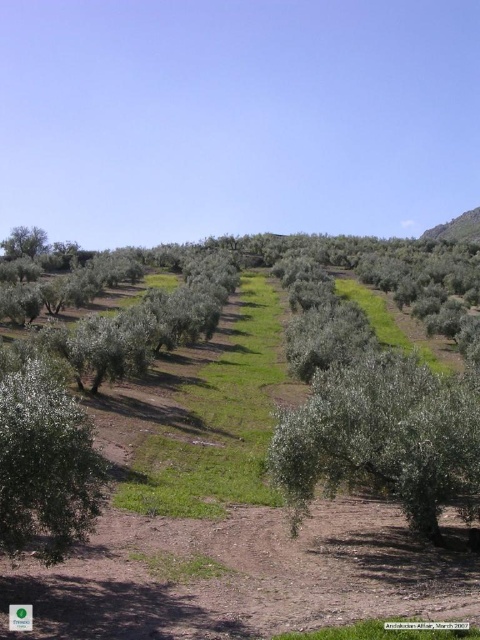
Looking at this image, you are a gardener planning to plant a new olive tree between the green leafy tree at center and the green leafy tree at lower left. The new tree requires a minimum of 20 feet of space between it and any existing trees to thrive. Based on the current spacing between the existing trees, do you think this is feasible?

The green leafy tree at center and green leafy tree at lower left are 25.06 feet apart. Since the new tree requires 20 feet of space between it and existing trees, planting it between them would require at least 40 feet of total space. However, the current distance is only 25.06 feet, so it is not feasible to plant the new tree there.

You are standing at the point marked by the coordinates point (381, 438) in the olive grove. Looking around, you see a green leafy tree at center. Which direction should you walk to reach the green leafy tree at center?

Since the point (381, 438) corresponds to the green leafy tree at center, you are already at the green leafy tree at center.

You are a farmer planning to plant a new olive tree in the grove. You notice the green leafy tree at center and the green leafy tree at lower left. Which tree would you choose to plant a new tree next to, considering spacing requirements for healthy growth?

The green leafy tree at lower left is smaller in size, so planting a new tree next to it would allow for better spacing and healthier growth compared to the larger green leafy tree at center.